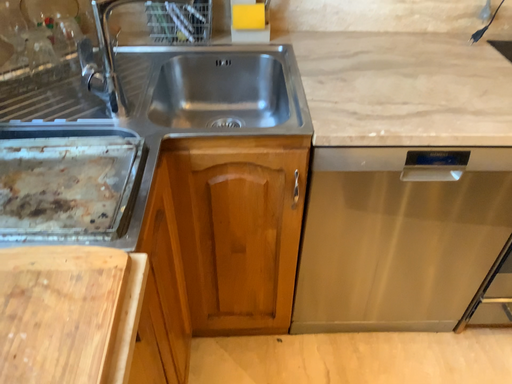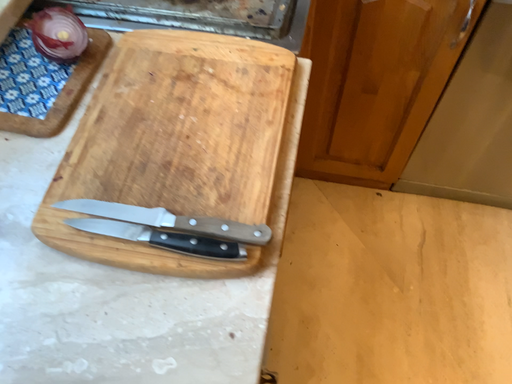
Question: Which way did the camera rotate in the video?

Choices:
 (A) rotated left
 (B) rotated right

Answer: (A)